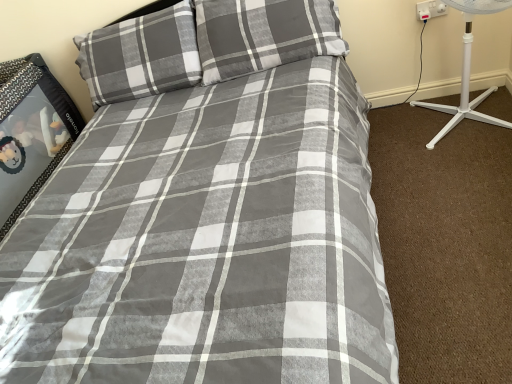
Measure the distance between point (466, 22) and camera.

The distance of point (466, 22) from camera is 6.52 feet.

I want to click on white plastic socket at upper right, so click(x=430, y=9).

You are a GUI agent. You are given a task and a screenshot of the screen. Output one action in this format:
    pyautogui.click(x=<x>, y=<y>)
    Task: Click on the white plastic fan at right
    
    Given the screenshot: What is the action you would take?
    pyautogui.click(x=467, y=71)

Which object is further away from the camera taking this photo, gray plaid pillow at upper left, the first pillow in the left-to-right sequence, or white plastic socket at upper right?

Positioned behind is white plastic socket at upper right.

Is the surface of gray plaid pillow at upper left, the first pillow in the left-to-right sequence, in direct contact with white plastic socket at upper right?

They are not placed beside each other.

Between gray plaid pillow at upper left, the first pillow in the left-to-right sequence, and white plastic socket at upper right, which one has larger width?

gray plaid pillow at upper left, the first pillow in the left-to-right sequence, is wider.

Which point is more distant from viewer, (240,52) or (446,12)?

The point (446,12) is more distant.

From a real-world perspective, is gray cotton pillow at upper center, the 1th pillow viewed from the right, positioned over white plastic socket at upper right based on gravity?

Indeed, from a real-world perspective, gray cotton pillow at upper center, the 1th pillow viewed from the right, stands above white plastic socket at upper right.

Can you confirm if gray cotton pillow at upper center, arranged as the second pillow when viewed from the left, is wider than white plastic socket at upper right?

Correct, the width of gray cotton pillow at upper center, arranged as the second pillow when viewed from the left, exceeds that of white plastic socket at upper right.

Are gray cotton pillow at upper center, the 1th pillow viewed from the right, and white plastic socket at upper right making contact?

No, gray cotton pillow at upper center, the 1th pillow viewed from the right, is not in contact with white plastic socket at upper right.

Measure the distance between gray plaid pillow at upper left, the second pillow when ordered from right to left, and gray cotton pillow at upper center, arranged as the second pillow when viewed from the left.

They are 12.62 inches apart.

Which is correct: gray plaid pillow at upper left, the second pillow when ordered from right to left, is inside gray cotton pillow at upper center, arranged as the second pillow when viewed from the left, or outside of it?

gray plaid pillow at upper left, the second pillow when ordered from right to left, is located beyond the bounds of gray cotton pillow at upper center, arranged as the second pillow when viewed from the left.

From the image's perspective, relative to gray cotton pillow at upper center, arranged as the second pillow when viewed from the left, is gray plaid pillow at upper left, the second pillow when ordered from right to left, above or below?

gray plaid pillow at upper left, the second pillow when ordered from right to left, is situated lower than gray cotton pillow at upper center, arranged as the second pillow when viewed from the left, in the image.

Between gray cotton pillow at upper center, arranged as the second pillow when viewed from the left, and white plastic fan at right, which one appears on the right side from the viewer's perspective?

Positioned to the right is white plastic fan at right.

Is gray cotton pillow at upper center, the 1th pillow viewed from the right, looking in the opposite direction of white plastic fan at right?

That's not correct — gray cotton pillow at upper center, the 1th pillow viewed from the right, is not looking away from white plastic fan at right.

Is gray cotton pillow at upper center, the 1th pillow viewed from the right, far from white plastic fan at right?

That's not correct — gray cotton pillow at upper center, the 1th pillow viewed from the right, is a little close to white plastic fan at right.

Is gray cotton pillow at upper center, arranged as the second pillow when viewed from the left, behind white plastic fan at right?

Yes, gray cotton pillow at upper center, arranged as the second pillow when viewed from the left, is further from the viewer.

Is gray cotton pillow at upper center, the 1th pillow viewed from the right, spatially inside gray plaid pillow at upper left, the second pillow when ordered from right to left, or outside of it?

gray cotton pillow at upper center, the 1th pillow viewed from the right, cannot be found inside gray plaid pillow at upper left, the second pillow when ordered from right to left.

From a real-world perspective, between gray cotton pillow at upper center, the 1th pillow viewed from the right, and gray plaid pillow at upper left, the first pillow in the left-to-right sequence, who is vertically lower?

gray plaid pillow at upper left, the first pillow in the left-to-right sequence, from a real-world perspective.

From the image's perspective, which is below, gray cotton pillow at upper center, arranged as the second pillow when viewed from the left, or gray plaid pillow at upper left, the first pillow in the left-to-right sequence?

gray plaid pillow at upper left, the first pillow in the left-to-right sequence, from the image's perspective.

Based on the photo, what's the angular difference between gray cotton pillow at upper center, the 1th pillow viewed from the right, and gray plaid pillow at upper left, the second pillow when ordered from right to left,'s facing directions?

1.68 degrees separate the facing orientations of gray cotton pillow at upper center, the 1th pillow viewed from the right, and gray plaid pillow at upper left, the second pillow when ordered from right to left.

Can you confirm if white plastic socket at upper right is positioned to the left of gray cotton pillow at upper center, the 1th pillow viewed from the right?

No.

Which is in front, point (444, 9) or point (265, 44)?

The point (265, 44) is in front.

Would you say white plastic socket at upper right is a long distance from gray cotton pillow at upper center, the 1th pillow viewed from the right?

No, white plastic socket at upper right is in close proximity to gray cotton pillow at upper center, the 1th pillow viewed from the right.

From the image's perspective, between white plastic fan at right and gray cotton pillow at upper center, the 1th pillow viewed from the right, who is located below?

white plastic fan at right, from the image's perspective.

Could you tell me if white plastic fan at right is turned towards gray cotton pillow at upper center, the 1th pillow viewed from the right?

No, white plastic fan at right is not facing towards gray cotton pillow at upper center, the 1th pillow viewed from the right.

Relative to gray cotton pillow at upper center, the 1th pillow viewed from the right, is white plastic fan at right in front or behind?

Clearly, white plastic fan at right is in front of gray cotton pillow at upper center, the 1th pillow viewed from the right.

Considering the positions of points (483, 5) and (200, 13), is point (483, 5) closer to camera compared to point (200, 13)?

Yes, it is in front of point (200, 13).

Image resolution: width=512 pixels, height=384 pixels. Identify the location of electric outlet below the gray plaid pillow at upper left, the first pillow in the left-to-right sequence (from a real-world perspective). (430, 9).

Locate an element on the screen. Image resolution: width=512 pixels, height=384 pixels. electric outlet that is above the gray cotton pillow at upper center, the 1th pillow viewed from the right (from the image's perspective) is located at coordinates (430, 9).

Which object lies further to the anchor point gray cotton pillow at upper center, the 1th pillow viewed from the right, gray plaid pillow at upper left, the first pillow in the left-to-right sequence, or white plastic fan at right?

white plastic fan at right.

Based on their spatial positions, is white plastic fan at right or gray cotton pillow at upper center, the 1th pillow viewed from the right, further from gray plaid pillow at upper left, the first pillow in the left-to-right sequence?

white plastic fan at right is positioned further to the anchor gray plaid pillow at upper left, the first pillow in the left-to-right sequence.

From the picture: When comparing their distances from white plastic fan at right, does gray plaid pillow at upper left, the first pillow in the left-to-right sequence, or gray cotton pillow at upper center, arranged as the second pillow when viewed from the left, seem further?

Among the two, gray plaid pillow at upper left, the first pillow in the left-to-right sequence, is located further to white plastic fan at right.

Looking at the image, which one is located further to white plastic socket at upper right, white plastic fan at right or gray plaid pillow at upper left, the first pillow in the left-to-right sequence?

Among the two, gray plaid pillow at upper left, the first pillow in the left-to-right sequence, is located further to white plastic socket at upper right.

Based on their spatial positions, is gray plaid pillow at upper left, the second pillow when ordered from right to left, or white plastic socket at upper right further from gray cotton pillow at upper center, arranged as the second pillow when viewed from the left?

white plastic socket at upper right is positioned further to the anchor gray cotton pillow at upper center, arranged as the second pillow when viewed from the left.

Considering their positions, is white plastic fan at right positioned closer to gray cotton pillow at upper center, arranged as the second pillow when viewed from the left, than gray plaid pillow at upper left, the first pillow in the left-to-right sequence?

gray plaid pillow at upper left, the first pillow in the left-to-right sequence.

Estimate the real-world distances between objects in this image. Which object is further from gray cotton pillow at upper center, the 1th pillow viewed from the right, white plastic socket at upper right or gray plaid pillow at upper left, the first pillow in the left-to-right sequence?

white plastic socket at upper right.

Based on their spatial positions, is white plastic socket at upper right or gray cotton pillow at upper center, the 1th pillow viewed from the right, closer to gray plaid pillow at upper left, the second pillow when ordered from right to left?

gray cotton pillow at upper center, the 1th pillow viewed from the right, lies closer to gray plaid pillow at upper left, the second pillow when ordered from right to left, than the other object.

You are a GUI agent. You are given a task and a screenshot of the screen. Output one action in this format:
    pyautogui.click(x=<x>, y=<y>)
    Task: Click on the pillow between gray plaid pillow at upper left, the second pillow when ordered from right to left, and white plastic fan at right, in the horizontal direction
    
    Given the screenshot: What is the action you would take?
    pyautogui.click(x=263, y=35)

This screenshot has width=512, height=384. Identify the location of electric outlet situated between gray plaid pillow at upper left, the second pillow when ordered from right to left, and white plastic fan at right from left to right. (430, 9).

Locate an element on the screen. electric outlet between gray cotton pillow at upper center, the 1th pillow viewed from the right, and white plastic fan at right from left to right is located at coordinates (430, 9).

This screenshot has width=512, height=384. Find the location of `pillow between gray plaid pillow at upper left, the second pillow when ordered from right to left, and white plastic socket at upper right from left to right`. pillow between gray plaid pillow at upper left, the second pillow when ordered from right to left, and white plastic socket at upper right from left to right is located at coordinates pos(263,35).